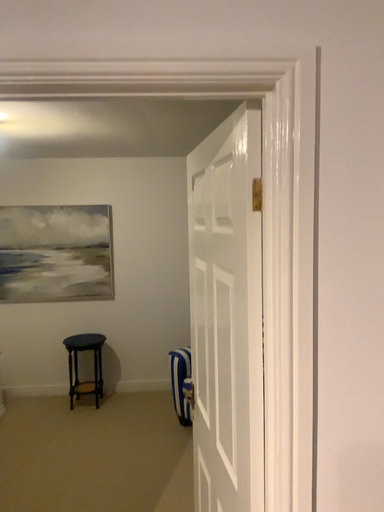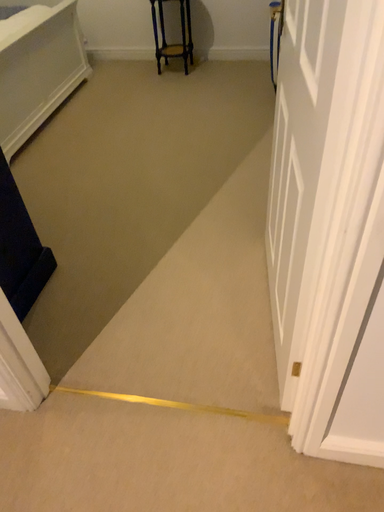
Question: How did the camera likely rotate when shooting the video?

Choices:
 (A) rotated right
 (B) rotated left

Answer: (B)